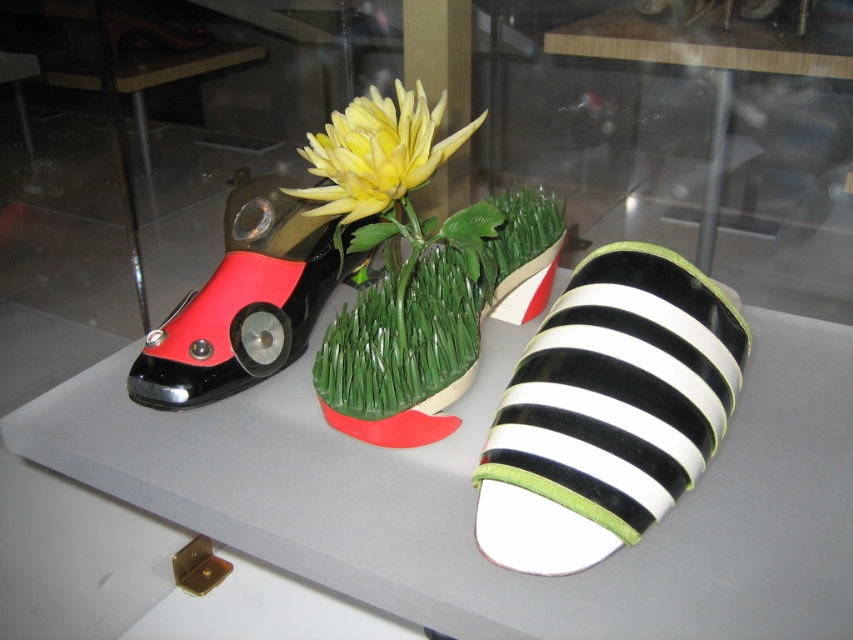
Can you confirm if green grass at center is wider than yellow matte flower at center?

Correct, the width of green grass at center exceeds that of yellow matte flower at center.

Who is taller, green grass at center or yellow matte flower at center?

green grass at center is taller.

Which is behind, point (425, 308) or point (335, 212)?

The point (425, 308) is behind.

You are a GUI agent. You are given a task and a screenshot of the screen. Output one action in this format:
    pyautogui.click(x=<x>, y=<y>)
    Task: Click on the green grass at center
    The height and width of the screenshot is (640, 853).
    Given the screenshot: What is the action you would take?
    pyautogui.click(x=427, y=314)

Who is positioned more to the right, black and white striped sandal at center or shiny black plastic toy car at left?

black and white striped sandal at center

Between point (595, 292) and point (268, 257), which one is positioned in front?

Positioned in front is point (595, 292).

The image size is (853, 640). In order to click on black and white striped sandal at center in this screenshot , I will do `click(608, 410)`.

Can you confirm if black and white striped sandal at center is positioned above green grass at center?

No, black and white striped sandal at center is not above green grass at center.

Can you confirm if black and white striped sandal at center is positioned below green grass at center?

Correct, black and white striped sandal at center is located below green grass at center.

Between point (732, 360) and point (467, 307), which one is positioned in front?

Point (732, 360)

Find the location of `black and white striped sandal at center`. black and white striped sandal at center is located at coordinates click(608, 410).